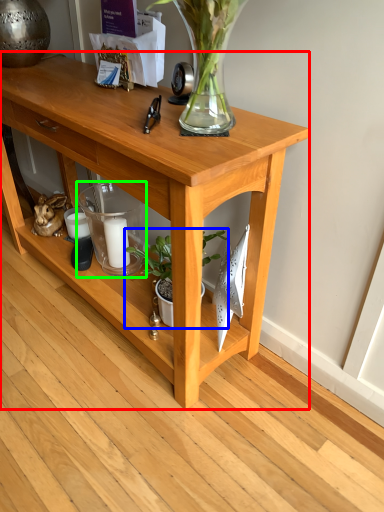
Question: Based on their relative distances, which object is nearer to table (highlighted by a red box)? Choose from houseplant (highlighted by a blue box) and candle holder (highlighted by a green box).

Choices:
 (A) houseplant
 (B) candle holder

Answer: (B)